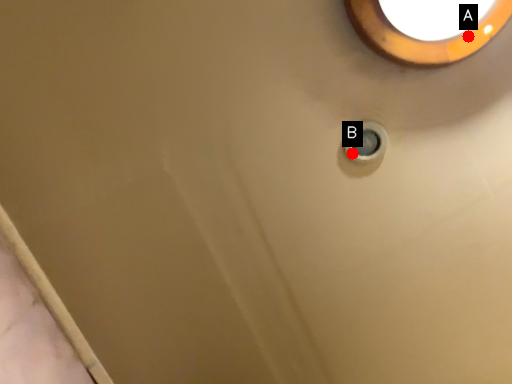
Question: Two points are circled on the image, labeled by A and B beside each circle. Which point appears farthest from the camera in this image?

Choices:
 (A) A is further
 (B) B is further

Answer: (B)